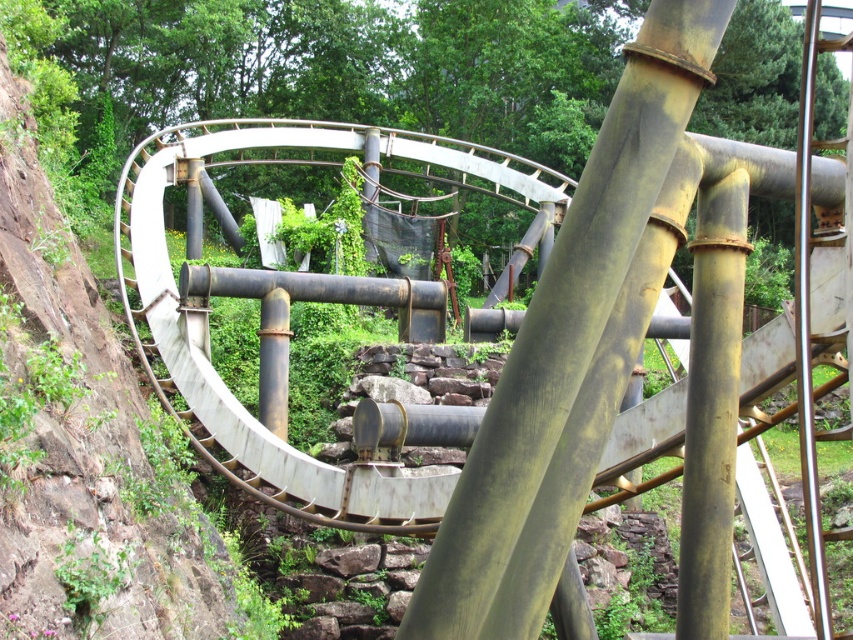
Question: Among these objects, which one is farthest from the camera?

Choices:
 (A) white matte roller coaster at upper left
 (B) rusty metal pipe at center

Answer: (B)

Question: Is white matte roller coaster at upper left thinner than rusty metal pipe at center?

Choices:
 (A) no
 (B) yes

Answer: (A)

Question: Is white matte roller coaster at upper left thinner than rusty metal pipe at center?

Choices:
 (A) yes
 (B) no

Answer: (B)

Question: From the image, what is the correct spatial relationship of white matte roller coaster at upper left in relation to rusty metal pipe at center?

Choices:
 (A) right
 (B) left

Answer: (B)